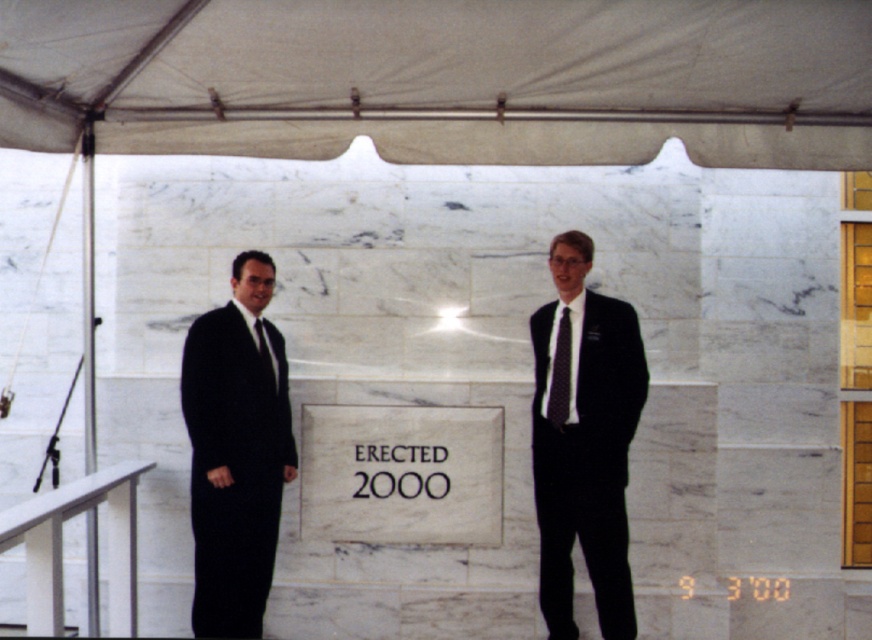
Question: Among these objects, which one is nearest to the camera?

Choices:
 (A) black silk tie at left
 (B) metallic silver rail at lower left
 (C) black satin suit at left
 (D) white fabric canopy at upper center

Answer: (D)

Question: Can you confirm if black satin suit at left is positioned to the left of black silk tie at right?

Choices:
 (A) no
 (B) yes

Answer: (B)

Question: Which of the following is the closest to the observer?

Choices:
 (A) white fabric canopy at upper center
 (B) metallic silver rail at lower left

Answer: (A)

Question: Is the position of white fabric canopy at upper center more distant than that of metallic silver rail at lower left?

Choices:
 (A) yes
 (B) no

Answer: (B)

Question: Which object is farther from the camera taking this photo?

Choices:
 (A) black satin suit at center
 (B) metallic silver rail at lower left
 (C) black silk tie at left

Answer: (C)

Question: From the image, what is the correct spatial relationship of black silk tie at right in relation to black silk tie at left?

Choices:
 (A) above
 (B) below

Answer: (B)